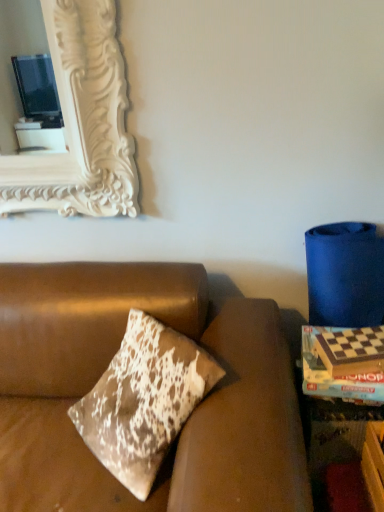
This screenshot has height=512, width=384. I want to click on wooden checkered game board at right, so click(334, 379).

What do you see at coordinates (334, 379) in the screenshot? Image resolution: width=384 pixels, height=512 pixels. I see `wooden checkered game board at right` at bounding box center [334, 379].

Describe the element at coordinates (106, 367) in the screenshot. I see `brown leather couch at center` at that location.

What are the coordinates of `brown leather couch at center` in the screenshot? It's located at [x=106, y=367].

Locate an element on the screen. The width and height of the screenshot is (384, 512). wooden checkered game board at right is located at coordinates point(334,379).

Visually, is brown leather couch at center positioned to the left or to the right of wooden checkered game board at right?

In the image, brown leather couch at center appears on the left side of wooden checkered game board at right.

Consider the image. Considering their positions, is brown leather couch at center located in front of or behind wooden checkered game board at right?

brown leather couch at center is positioned closer to the viewer than wooden checkered game board at right.

Between point (191, 331) and point (347, 383), which one is positioned behind?

The point (191, 331) is more distant.

From the image's perspective, relative to wooden checkered game board at right, is brown leather couch at center above or below?

brown leather couch at center is below wooden checkered game board at right.

From a real-world perspective, does brown leather couch at center sit lower than wooden checkered game board at right?

Yes, from a real-world perspective, brown leather couch at center is under wooden checkered game board at right.

Which object is thinner, brown leather couch at center or wooden checkered game board at right?

wooden checkered game board at right is thinner.

Considering the relative sizes of brown leather couch at center and wooden checkered game board at right in the image provided, is brown leather couch at center shorter than wooden checkered game board at right?

In fact, brown leather couch at center may be taller than wooden checkered game board at right.

Is brown leather couch at center smaller than wooden checkered game board at right?

Actually, brown leather couch at center might be larger than wooden checkered game board at right.

Is brown leather couch at center outside of wooden checkered game board at right?

Yes, brown leather couch at center is outside of wooden checkered game board at right.

Can you see brown leather couch at center touching wooden checkered game board at right?

No, brown leather couch at center is not making contact with wooden checkered game board at right.

Is brown leather couch at center oriented away from wooden checkered game board at right?

brown leather couch at center is not turned away from wooden checkered game board at right.

Measure the distance from brown leather couch at center to wooden checkered game board at right.

brown leather couch at center is 17.85 inches away from wooden checkered game board at right.

Where is `studio couch located on the left of wooden checkered game board at right`? The height and width of the screenshot is (512, 384). studio couch located on the left of wooden checkered game board at right is located at coordinates (106, 367).

Visually, is wooden checkered game board at right positioned to the left or to the right of brown leather couch at center?

Based on their positions, wooden checkered game board at right is located to the right of brown leather couch at center.

Considering the positions of objects wooden checkered game board at right and brown leather couch at center in the image provided, who is behind, wooden checkered game board at right or brown leather couch at center?

wooden checkered game board at right is further away from the camera.

Is point (352, 383) less distant than point (212, 322)?

Yes, point (352, 383) is closer to viewer.

From the image's perspective, is wooden checkered game board at right above brown leather couch at center?

Yes, from the image's perspective, wooden checkered game board at right is above brown leather couch at center.

From a real-world perspective, who is located lower, wooden checkered game board at right or brown leather couch at center?

From a 3D spatial view, brown leather couch at center is below.

Which object is thinner, wooden checkered game board at right or brown leather couch at center?

wooden checkered game board at right.

Does wooden checkered game board at right have a lesser height compared to brown leather couch at center?

Correct, wooden checkered game board at right is not as tall as brown leather couch at center.

Based on the photo, considering the sizes of wooden checkered game board at right and brown leather couch at center in the image, is wooden checkered game board at right bigger or smaller than brown leather couch at center?

Considering their sizes, wooden checkered game board at right takes up less space than brown leather couch at center.

Is wooden checkered game board at right not within brown leather couch at center?

Yes, wooden checkered game board at right is located beyond the bounds of brown leather couch at center.

Is wooden checkered game board at right not near brown leather couch at center?

No, wooden checkered game board at right is not far from brown leather couch at center.

Is wooden checkered game board at right looking in the opposite direction of brown leather couch at center?

That's not correct — wooden checkered game board at right is not looking away from brown leather couch at center.

Measure the distance between wooden checkered game board at right and brown leather couch at center.

wooden checkered game board at right is 17.85 inches from brown leather couch at center.

Where is `magazine on the right of brown leather couch at center`? magazine on the right of brown leather couch at center is located at coordinates (334, 379).

You are a GUI agent. You are given a task and a screenshot of the screen. Output one action in this format:
    pyautogui.click(x=<x>, y=<y>)
    Task: Click on the studio couch in front of the wooden checkered game board at right
    
    Given the screenshot: What is the action you would take?
    pyautogui.click(x=106, y=367)

Find the location of a particular element. The height and width of the screenshot is (512, 384). magazine located above the brown leather couch at center (from the image's perspective) is located at coordinates pos(334,379).